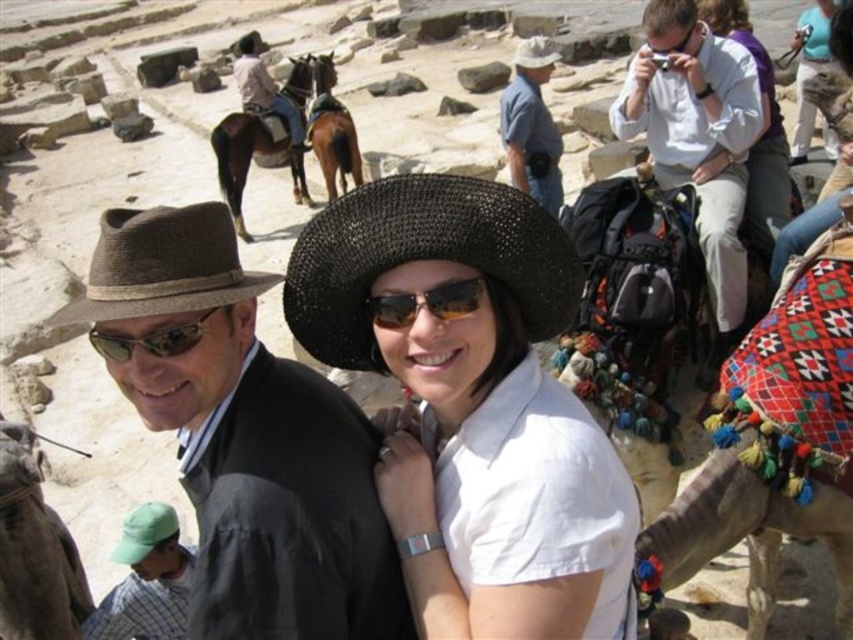
Question: Which object is positioned farthest from the green fabric cap at lower left?

Choices:
 (A) black straw hat at center
 (B) light blue denim jeans at upper right
 (C) brown felt hat at left
 (D) matte black goggles at left

Answer: (B)

Question: From the image, what is the correct spatial relationship of brown felt hat at left in relation to light blue denim shirt at upper center?

Choices:
 (A) below
 (B) above

Answer: (A)

Question: Which point is farther to the camera?

Choices:
 (A) light blue denim shirt at upper center
 (B) brown leather horse at upper center
 (C) matte black goggles at left

Answer: (B)

Question: Where is brown textured camel at lower right located in relation to matte black goggles at left in the image?

Choices:
 (A) left
 (B) right

Answer: (A)

Question: Is black straw hat at center thinner than light blue denim shirt at upper center?

Choices:
 (A) yes
 (B) no

Answer: (A)

Question: Which point appears farthest from the camera in this image?

Choices:
 (A) 531,376
 (B) 459,308

Answer: (A)